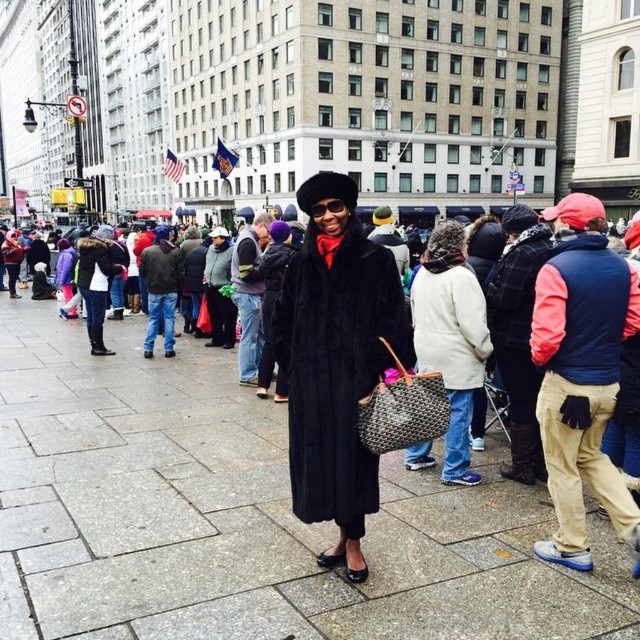
You are a fashion designer observing the scene and want to create a new collection inspired by the coats seen in the image. Which coat, the velvet black coat at center or the white wool coat at center, would you choose if you want to emphasize a bold and dramatic look?

The velvet black coat at center has a larger size compared to the white wool coat at center, making it a better choice for emphasizing a bold and dramatic look.

You are standing at the point marked as point (244, 516) in the image. What type of surface are you standing on?

The point (244, 516) is on smooth concrete pavement at center.